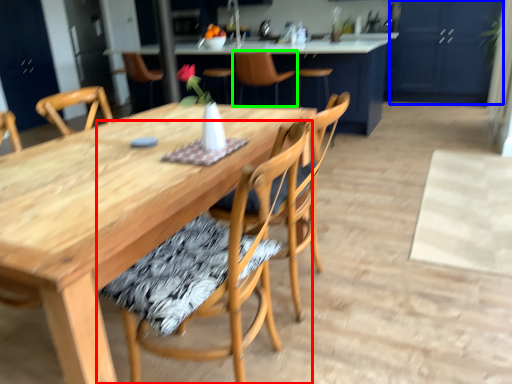
Question: Which object is positioned farthest from chair (highlighted by a red box)? Select from cabinetry (highlighted by a blue box) and chair (highlighted by a green box).

Choices:
 (A) cabinetry
 (B) chair

Answer: (A)